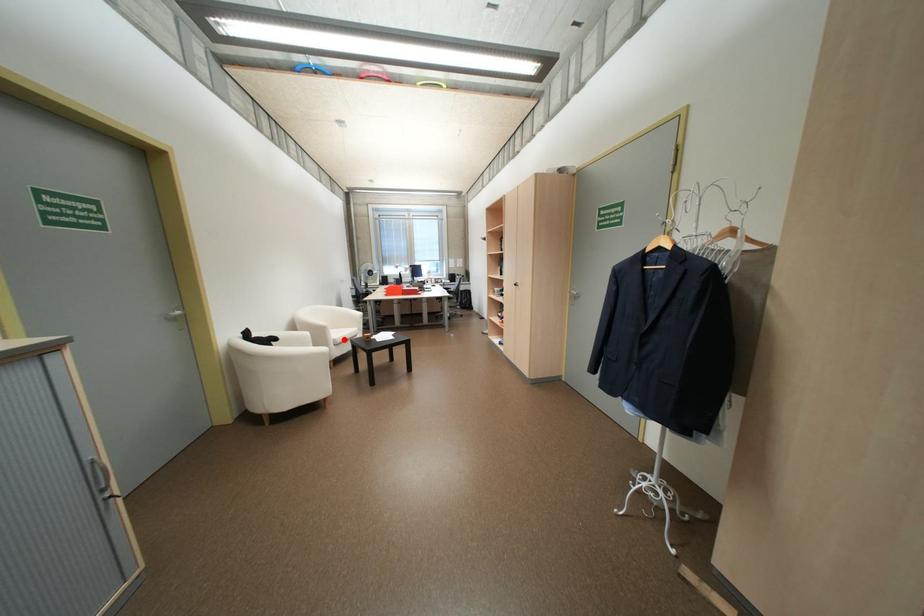
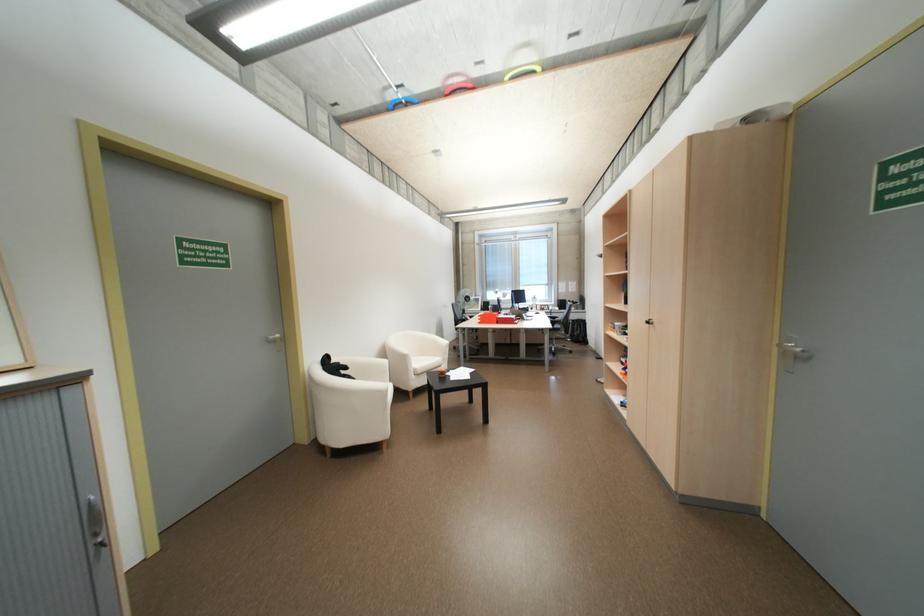
In the second image, find the point that corresponds to the highlighted location in the first image.

(424, 369)